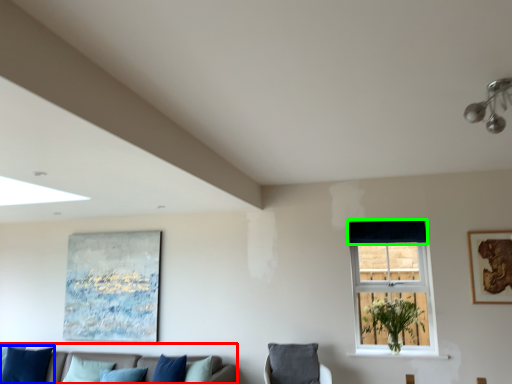
Question: Which is nearer to the studio couch (highlighted by a red box)? pillow (highlighted by a blue box) or curtain (highlighted by a green box).

Choices:
 (A) pillow
 (B) curtain

Answer: (A)